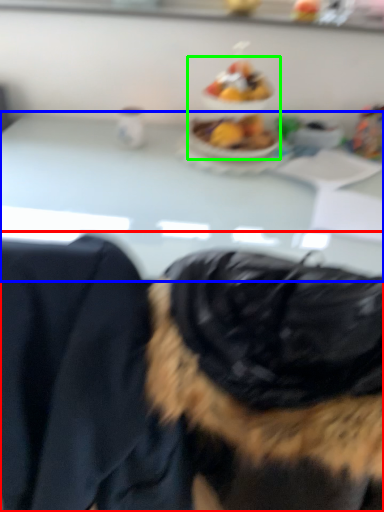
Question: Based on their relative distances, which object is nearer to dog (highlighted by a red box)? Choose from table (highlighted by a blue box) and food (highlighted by a green box).

Choices:
 (A) table
 (B) food

Answer: (A)